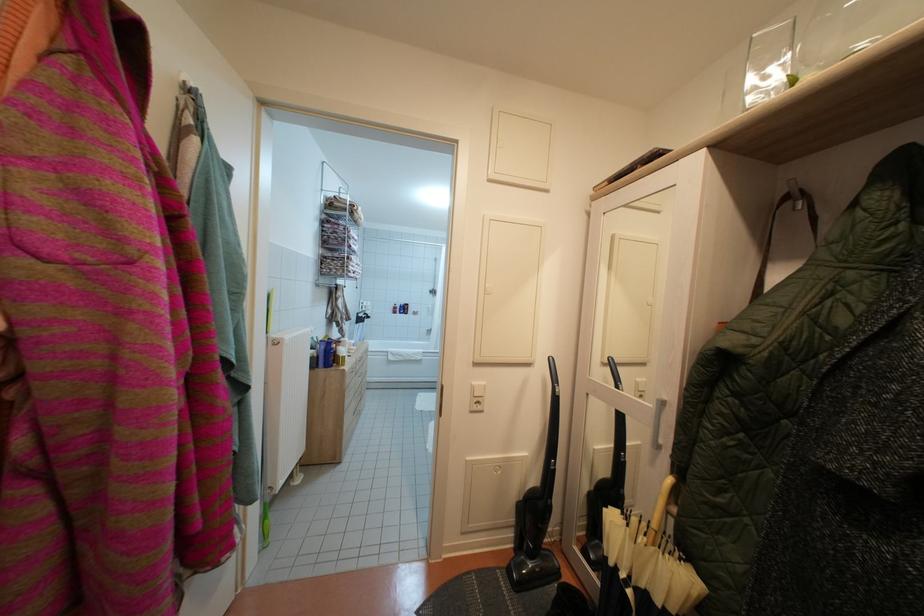
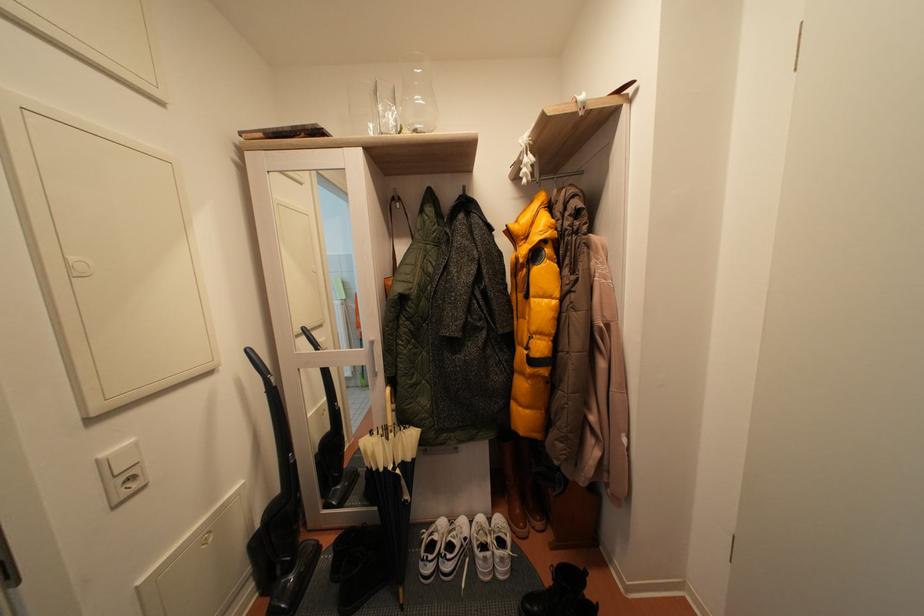
Question: How did the camera likely rotate?

Choices:
 (A) Left
 (B) Right
 (C) Up
 (D) Down

Answer: (B)